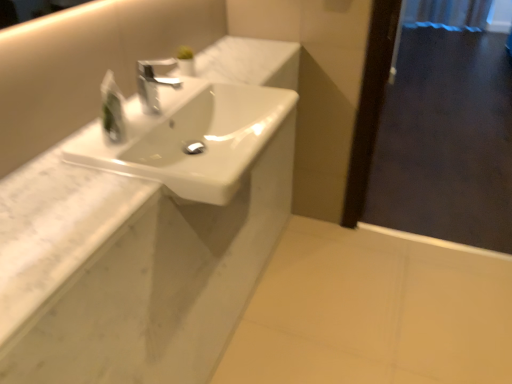
Where is `free space behind satin nickel faucet at center`? Image resolution: width=512 pixels, height=384 pixels. free space behind satin nickel faucet at center is located at coordinates point(169,90).